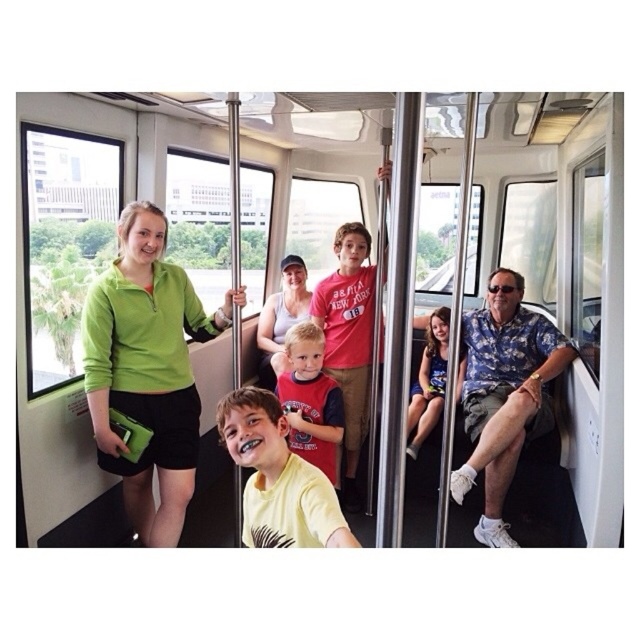
Where is the red cotton shirt at center located in the image?

The red cotton shirt at center is located at point 0.627 on the x axis and 0.486 on the y axis.

From the picture: You are a passenger in the cable car and want to know where the green matte jacket at center is located. Based on the coordinate system where the bottom left corner is the origin, can you tell me its position?

The green matte jacket at center is located at point (x=147, y=369).